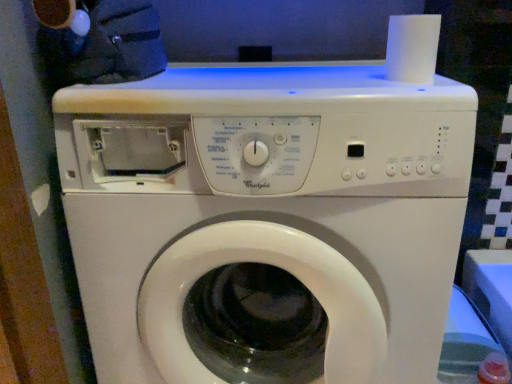
Question: From a real-world perspective, is white plastic washing machine at center physically located above or below white matte paper towel at upper right?

Choices:
 (A) above
 (B) below

Answer: (B)

Question: Considering their positions, is white plastic washing machine at center located in front of or behind white matte paper towel at upper right?

Choices:
 (A) front
 (B) behind

Answer: (A)

Question: Is point (246, 312) positioned closer to the camera than point (404, 43)?

Choices:
 (A) farther
 (B) closer

Answer: (A)

Question: In terms of size, does white matte paper towel at upper right appear bigger or smaller than white plastic washing machine at center?

Choices:
 (A) big
 (B) small

Answer: (B)

Question: Does point (388, 39) appear closer or farther from the camera than point (223, 243)?

Choices:
 (A) closer
 (B) farther

Answer: (B)

Question: Is white matte paper towel at upper right taller or shorter than white plastic washing machine at center?

Choices:
 (A) short
 (B) tall

Answer: (A)

Question: From a real-world perspective, is white matte paper towel at upper right positioned above or below white plastic washing machine at center?

Choices:
 (A) below
 (B) above

Answer: (B)